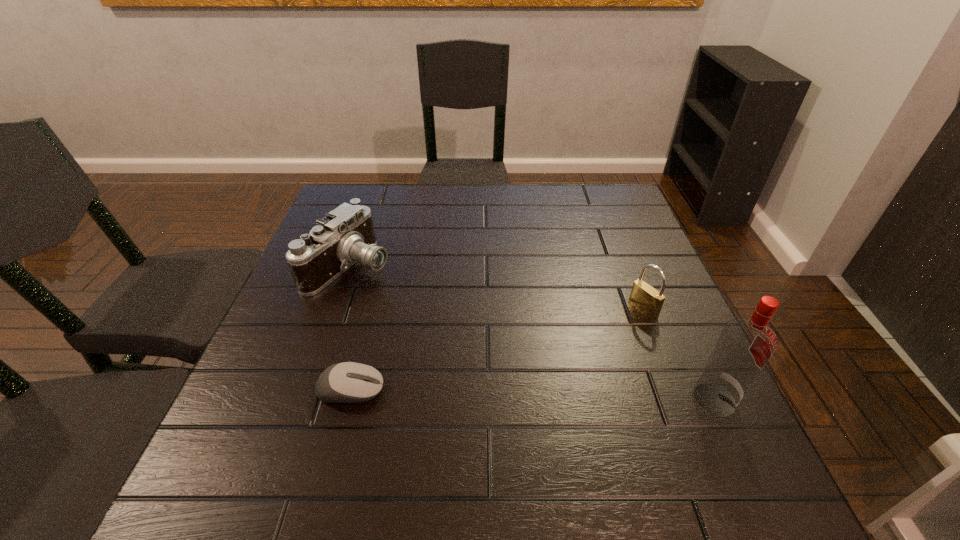
You are a GUI agent. You are given a task and a screenshot of the screen. Output one action in this format:
    pyautogui.click(x=<x>, y=<y>)
    Task: Click on the vacant spot on the desktop that is between the shortest object and the vodka and is positioned at the lens of the camera
    This screenshot has width=960, height=540.
    Given the screenshot: What is the action you would take?
    pyautogui.click(x=567, y=395)

Find the location of `free space on the desktop that is between the computer equipment and the vodka and is positioned on the front-facing side of the second object from right to left`. free space on the desktop that is between the computer equipment and the vodka and is positioned on the front-facing side of the second object from right to left is located at coordinates (500, 394).